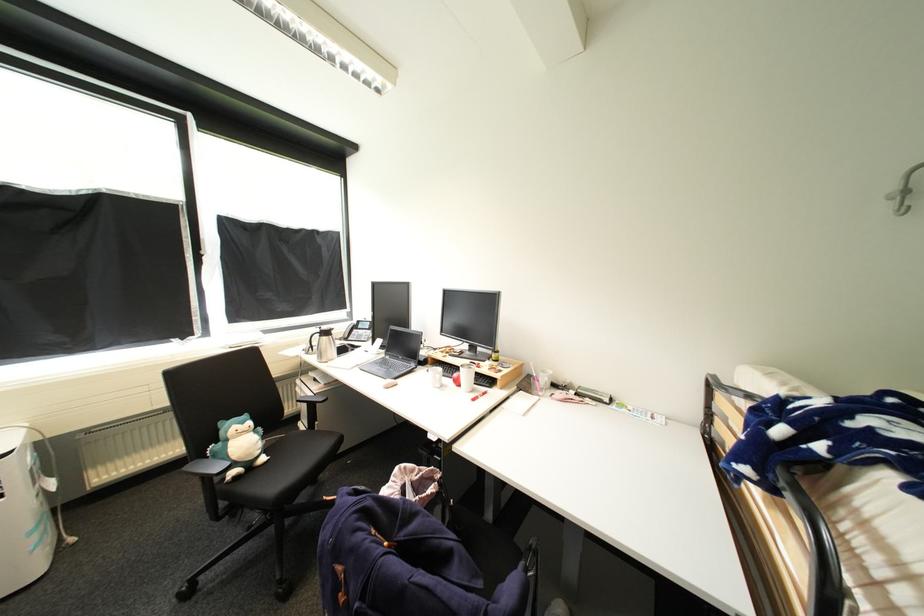
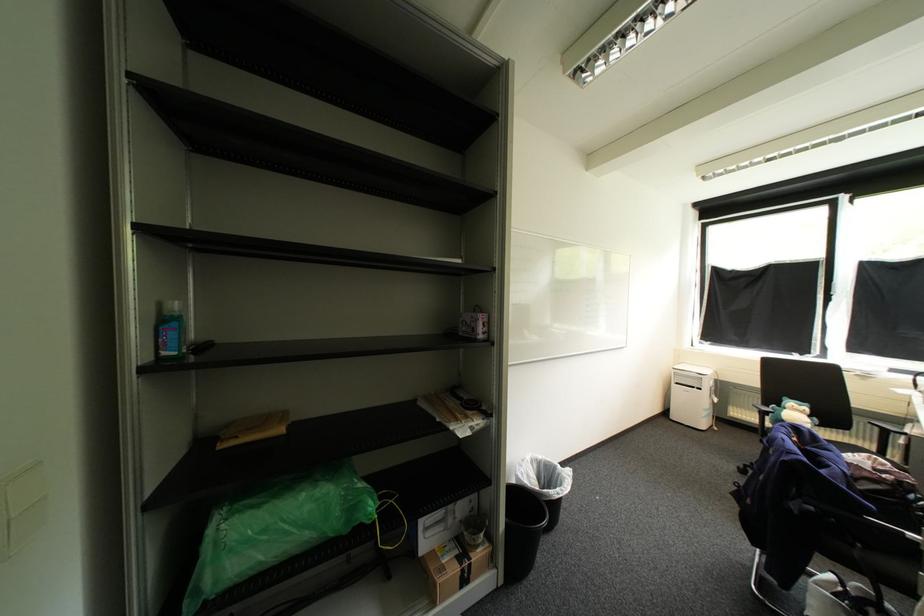
Where in the second image is the point corresponding to point (445, 509) from the first image?

(885, 488)